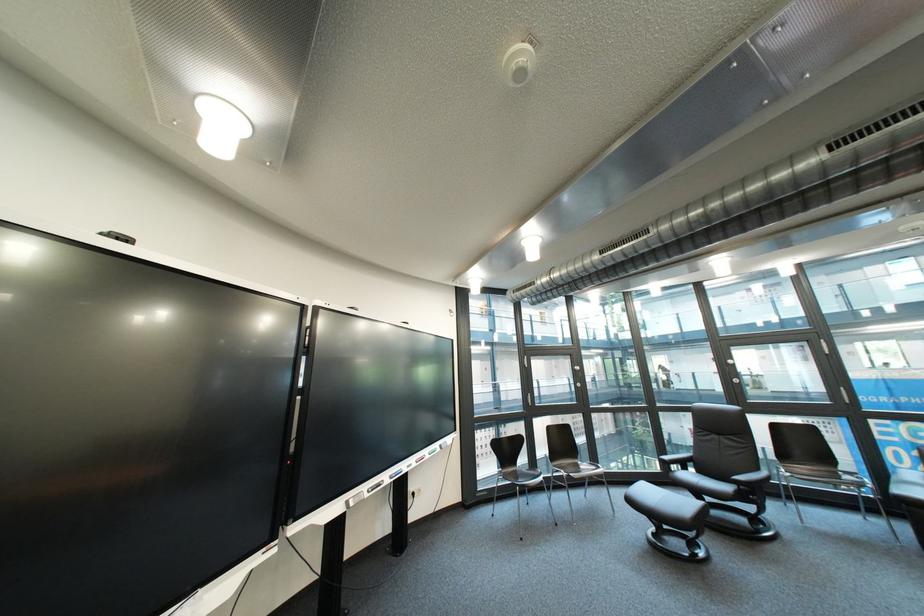
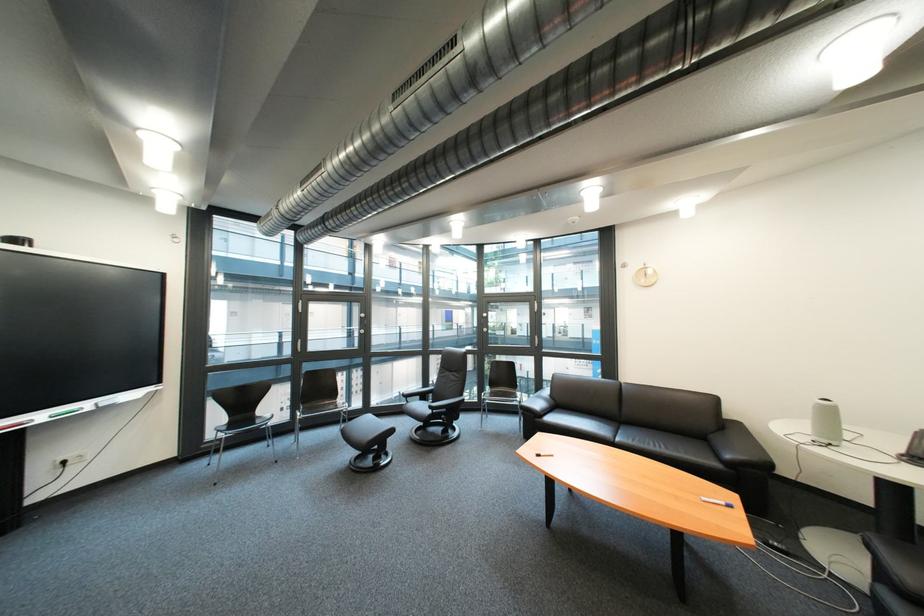
Locate, in the second image, the point that corresponds to [450,447] in the first image.

(101, 406)